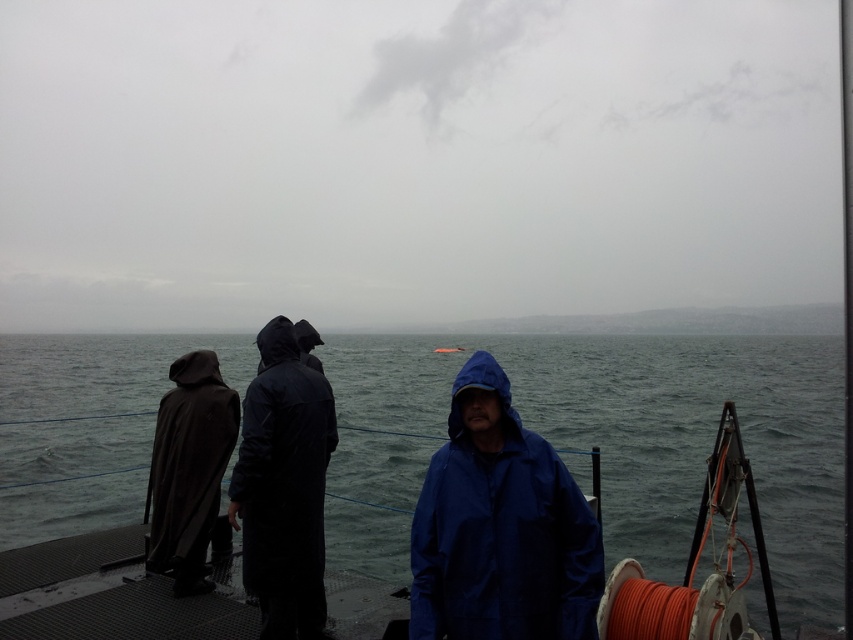
You are standing on the boat deck and need to move from the dark matte trench coat at left to the gray matte water at center. Considering the deck space, can you walk directly between them without stepping aside?

The gray matte water at center has a larger width than the dark matte trench coat at left, so there is sufficient space to walk directly between them without needing to step aside.

You are a photographer trying to capture a group photo of the people on the boat deck. You notice the blue waterproof jacket at center and the dark matte raincoat at center. Which clothing item is shorter in height?

The blue waterproof jacket at center is not as tall as the dark matte raincoat at center, so the blue waterproof jacket at center is shorter in height.

Based on the photo, you are a passenger on the boat and need to choose between the blue waterproof jacket at center and the dark matte trench coat at left. Which one is shorter in height?

The blue waterproof jacket at center is shorter than the dark matte trench coat at left.